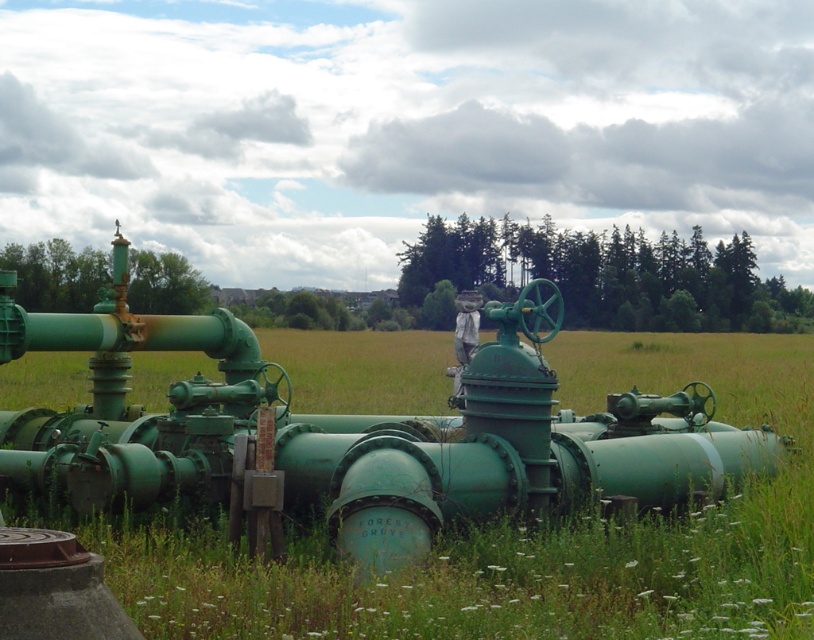
You are an inspector checking the industrial setup. You notice the green matte pipes at center and the white fabric mannequin at center. Which object is bigger in size?

Result: The green matte pipes at center has a larger size compared to the white fabric mannequin at center.

You are a maintenance worker needing to reach the white fabric mannequin at center from the green matte pipes at center. The safety regulations state that you must stay within a 15 meter radius of the pipes. Can you safely reach the mannequin without violating the safety rule?

The distance between the green matte pipes at center and the white fabric mannequin at center is 16.07 meters, which exceeds the 15 meter safety radius. Therefore, you cannot safely reach the mannequin without violating the safety regulations.

You are a technician who needs to locate the green matte pipes at center in a grassy field. According to the coordinates provided, where would you find them?

The green matte pipes at center are located at coordinates point (521, 536).